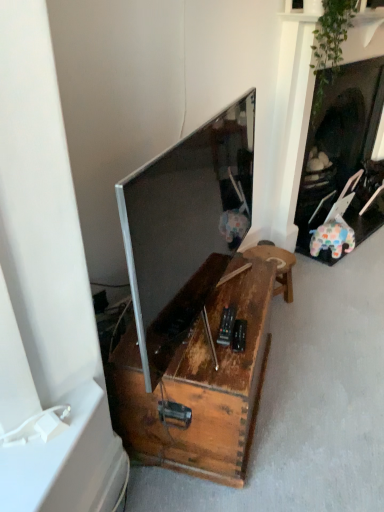
Question: Looking at the image, does satin silver television at center seem bigger or smaller compared to rustic wood stool at lower center?

Choices:
 (A) small
 (B) big

Answer: (B)

Question: Relative to rustic wood stool at lower center, is satin silver television at center in front or behind?

Choices:
 (A) behind
 (B) front

Answer: (B)

Question: Estimate the real-world distances between objects in this image. Which object is closer to the rustic wood stool at lower center?

Choices:
 (A) satin silver television at center
 (B) rusty wood table at center

Answer: (B)

Question: Which is farther from the rustic wood stool at lower center?

Choices:
 (A) satin silver television at center
 (B) rusty wood table at center

Answer: (A)